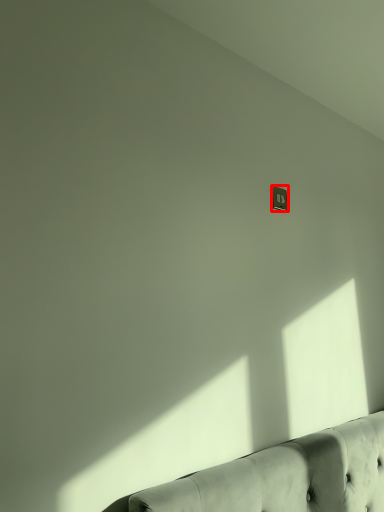
Question: From the image's perspective, considering the relative positions of electric outlet (annotated by the red box) and studio couch in the image provided, where is electric outlet (annotated by the red box) located with respect to the staircase?

Choices:
 (A) below
 (B) above

Answer: (B)